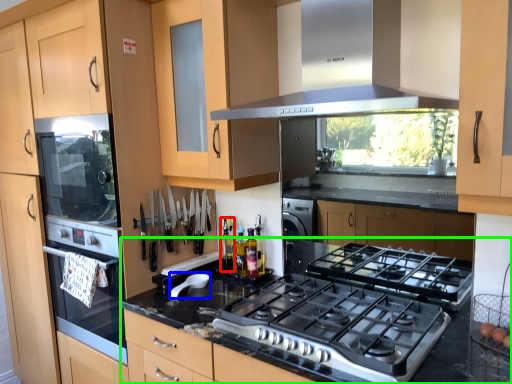
Question: Which is nearer to the bottle (highlighted by a red box)? appliance (highlighted by a blue box) or countertop (highlighted by a green box).

Choices:
 (A) appliance
 (B) countertop

Answer: (A)